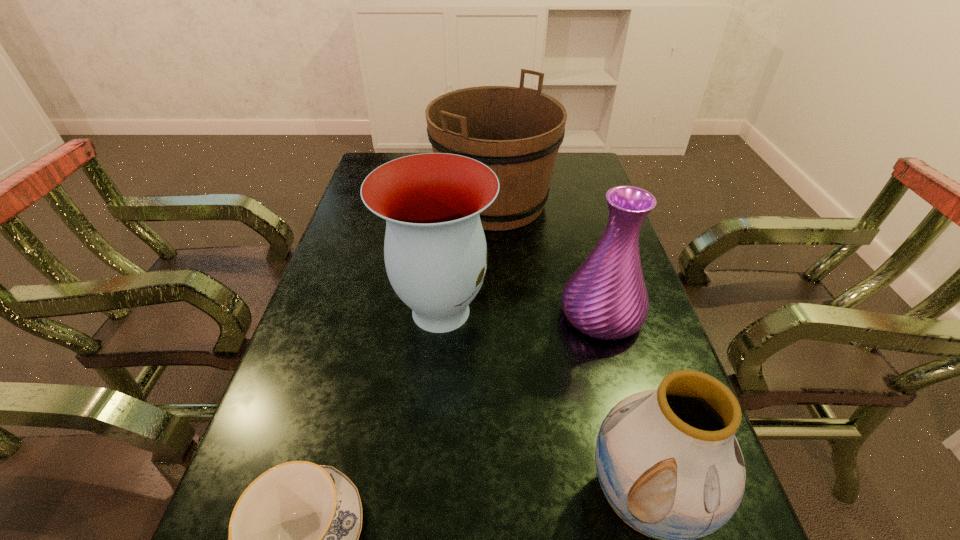
Locate which object is the second closest to the leftmost vase. Please provide its 2D coordinates. Your answer should be formatted as a tuple, i.e. [(x, y)], where the tuple contains the x and y coordinates of a point satisfying the conditions above.

[(516, 131)]

Locate an element on the screen. vase that is the second nearest to the bucket is located at coordinates (606, 298).

Identify which vase is the second closest to the leftmost vase. Please provide its 2D coordinates. Your answer should be formatted as a tuple, i.e. [(x, y)], where the tuple contains the x and y coordinates of a point satisfying the conditions above.

[(668, 462)]